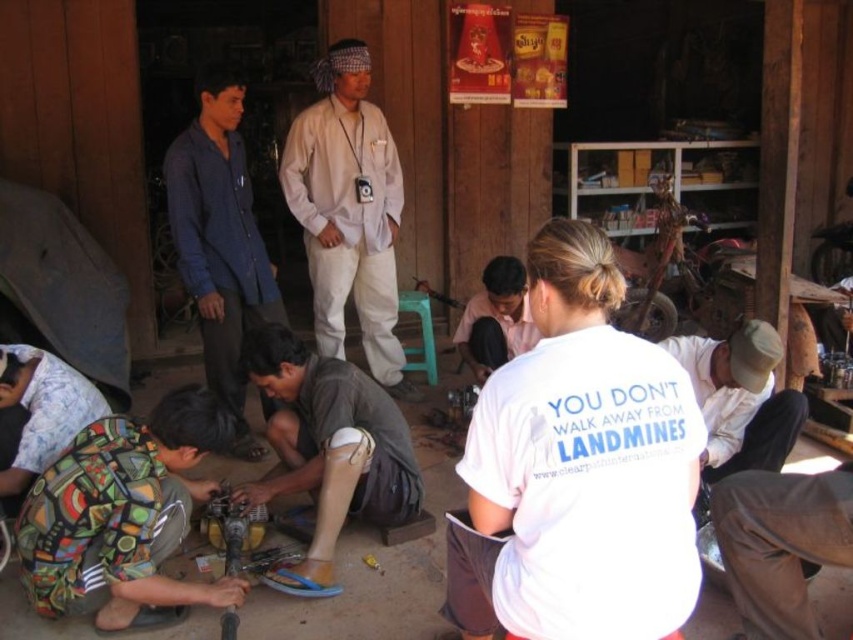
You are a photographer standing in the workshop. You want to take a photo of the brown fabric prosthetic leg at lower center and the blue cotton shirt at upper left. Which object should you focus on first to ensure both are in the frame?

The brown fabric prosthetic leg at lower center is in front of the blue cotton shirt at upper left, so you should focus on the brown fabric prosthetic leg at lower center first to ensure both are in the frame.

You are standing in the workshop and see the multicolored fabric at lower left and the dark gray fabric shirt at center. Which object is positioned lower in the image?

The multicolored fabric at lower left is positioned lower than the dark gray fabric shirt at center.